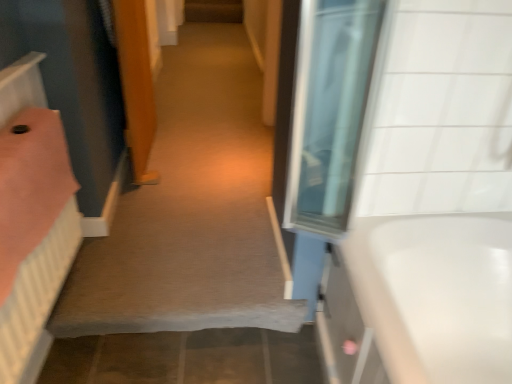
Describe the element at coordinates (191, 210) in the screenshot. This screenshot has width=512, height=384. I see `carpet at center` at that location.

This screenshot has height=384, width=512. What do you see at coordinates (436, 294) in the screenshot? I see `white glossy bathtub at right` at bounding box center [436, 294].

Where is `white glossy bathtub at right`? The height and width of the screenshot is (384, 512). white glossy bathtub at right is located at coordinates (436, 294).

Where is `carpet at center`? carpet at center is located at coordinates (191, 210).

Is white glossy bathtub at right located within pink fabric bed at left?

No, white glossy bathtub at right is not surrounded by pink fabric bed at left.

Considering the relative sizes of pink fabric bed at left and white glossy bathtub at right in the image provided, is pink fabric bed at left taller than white glossy bathtub at right?

Yes.

Is pink fabric bed at left far from white glossy bathtub at right?

Indeed, pink fabric bed at left is not near white glossy bathtub at right.

Identify the location of bathtub behind the pink fabric bed at left. (436, 294).

Consider the image. Considering the relative sizes of carpet at center and white glossy bathtub at right in the image provided, is carpet at center taller than white glossy bathtub at right?

Incorrect, the height of carpet at center is not larger of that of white glossy bathtub at right.

Where is `plain below the white glossy bathtub at right (from a real-world perspective)`? plain below the white glossy bathtub at right (from a real-world perspective) is located at coordinates (191, 210).

From the image's perspective, which one is positioned higher, carpet at center or white glossy bathtub at right?

From the image's view, carpet at center is above.

In the scene shown: Is carpet at center wider or thinner than wooden door at center?

In the image, carpet at center appears to be wider than wooden door at center.

From the picture: Considering the relative positions of carpet at center and wooden door at center in the image provided, is carpet at center behind wooden door at center?

No.

Is wooden door at center at the back of carpet at center?

carpet at center is not turned away from wooden door at center.

Looking at this image, from a real-world perspective, which object rests below the other?

carpet at center is physically lower.

Identify the location of bathtub in front of the wooden door at center. The height and width of the screenshot is (384, 512). (436, 294).

Does point (146, 28) come farther from viewer compared to point (418, 342)?

Yes.

From the image's perspective, between wooden door at center and white glossy bathtub at right, who is located below?

white glossy bathtub at right.

Does wooden door at center come behind white glossy bathtub at right?

Yes, the depth of wooden door at center is greater than that of white glossy bathtub at right.

From a real-world perspective, is white glossy bathtub at right below pink fabric bed at left?

Yes, from a real-world perspective, white glossy bathtub at right is under pink fabric bed at left.

From the image's perspective, relative to pink fabric bed at left, is white glossy bathtub at right above or below?

white glossy bathtub at right is situated lower than pink fabric bed at left in the image.

Does point (499, 310) appear closer or farther from the camera than point (36, 362)?

Point (499, 310) is farther from the camera than point (36, 362).

Is pink fabric bed at left aimed at wooden door at center?

No.

Is pink fabric bed at left closer to camera compared to wooden door at center?

Yes, pink fabric bed at left is closer to the camera.

From a real-world perspective, is pink fabric bed at left physically above wooden door at center?

No.

Considering the sizes of objects pink fabric bed at left and wooden door at center in the image provided, who is smaller, pink fabric bed at left or wooden door at center?

pink fabric bed at left.

Is pink fabric bed at left at the left side of carpet at center?

Yes.

Based on the photo, is carpet at center located within pink fabric bed at left?

Actually, carpet at center is outside pink fabric bed at left.

Who is bigger, pink fabric bed at left or carpet at center?

carpet at center.

Is pink fabric bed at left thinner than carpet at center?

Correct, the width of pink fabric bed at left is less than that of carpet at center.

Locate an element on the screen. The height and width of the screenshot is (384, 512). bed in front of the white glossy bathtub at right is located at coordinates (31, 219).

In the image, there is a white glossy bathtub at right. At what (x,y) coordinates should I click in order to perform the action: click on plain below it (from a real-world perspective). Please return your answer as a coordinate pair (x, y). This screenshot has height=384, width=512. Looking at the image, I should click on (191, 210).

Estimate the real-world distances between objects in this image. Which object is closer to white glossy bathtub at right, carpet at center or pink fabric bed at left?

carpet at center is closer to white glossy bathtub at right.

Looking at the image, which one is located further to wooden door at center, white glossy bathtub at right or carpet at center?

Among the two, white glossy bathtub at right is located further to wooden door at center.

From the image, which object appears to be nearer to carpet at center, white glossy bathtub at right or pink fabric bed at left?

Among the two, pink fabric bed at left is located nearer to carpet at center.

Estimate the real-world distances between objects in this image. Which object is further from pink fabric bed at left, carpet at center or wooden door at center?

Based on the image, wooden door at center appears to be further to pink fabric bed at left.

From the image, which object appears to be farther from wooden door at center, white glossy bathtub at right or pink fabric bed at left?

Among the two, white glossy bathtub at right is located further to wooden door at center.

From the image, which object appears to be farther from pink fabric bed at left, white glossy bathtub at right or carpet at center?

Based on the image, white glossy bathtub at right appears to be further to pink fabric bed at left.

Which object lies nearer to the anchor point white glossy bathtub at right, pink fabric bed at left or wooden door at center?

pink fabric bed at left is positioned closer to the anchor white glossy bathtub at right.

When comparing their distances from white glossy bathtub at right, does pink fabric bed at left or carpet at center seem closer?

carpet at center.

This screenshot has width=512, height=384. Find the location of `plain between wooden door at center and white glossy bathtub at right in the horizontal direction`. plain between wooden door at center and white glossy bathtub at right in the horizontal direction is located at coordinates (191, 210).

At what (x,y) coordinates should I click in order to perform the action: click on plain between pink fabric bed at left and wooden door at center in the front-back direction. Please return your answer as a coordinate pair (x, y). Looking at the image, I should click on (191, 210).

Locate an element on the screen. plain situated between pink fabric bed at left and white glossy bathtub at right from left to right is located at coordinates (191, 210).

Where is `door between pink fabric bed at left and white glossy bathtub at right from left to right`? This screenshot has height=384, width=512. door between pink fabric bed at left and white glossy bathtub at right from left to right is located at coordinates (136, 84).